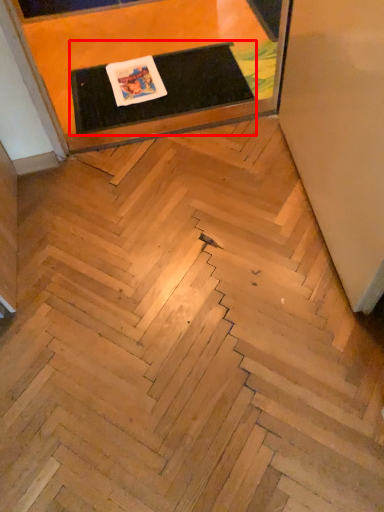
Question: From the image's perspective, where is table (annotated by the red box) located relative to furniture?

Choices:
 (A) above
 (B) below

Answer: (B)